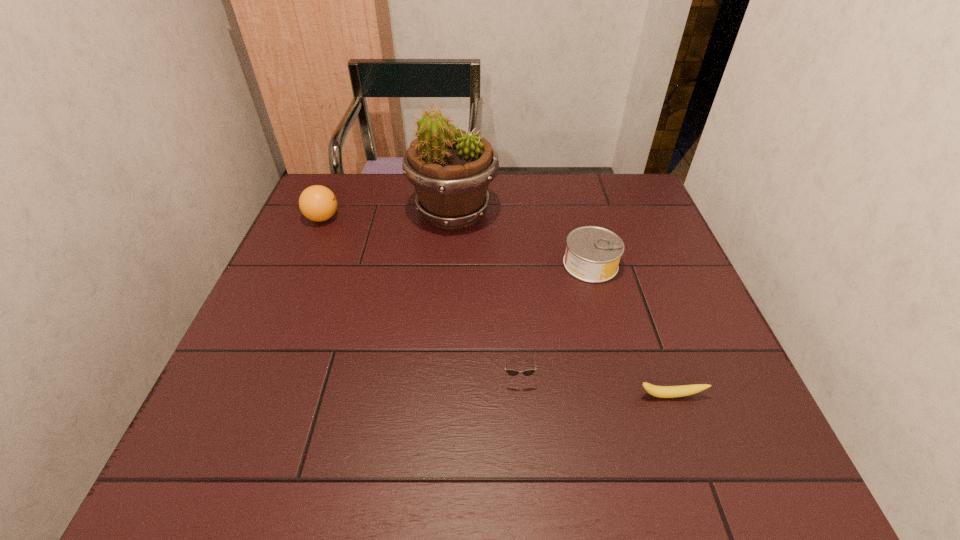
The width and height of the screenshot is (960, 540). Find the location of `vacant area located 0.150m in front of the lenses of the sunglasses`. vacant area located 0.150m in front of the lenses of the sunglasses is located at coordinates tap(525, 463).

Where is `free space located 0.140m on the upward curve of the banana`? This screenshot has height=540, width=960. free space located 0.140m on the upward curve of the banana is located at coordinates (697, 472).

What are the coordinates of `flowerpot located in the far edge section of the desktop` in the screenshot? It's located at (451, 169).

Where is `ping-pong ball that is at the far edge`? This screenshot has width=960, height=540. ping-pong ball that is at the far edge is located at coordinates (318, 203).

Find the location of a particular element. The height and width of the screenshot is (540, 960). object positioned at the left edge is located at coordinates (318, 203).

Identify the location of can that is at the right edge. The width and height of the screenshot is (960, 540). pos(593,253).

At what (x,y) coordinates should I click in order to perform the action: click on banana that is at the right edge. Please return your answer as a coordinate pair (x, y). Looking at the image, I should click on (685, 390).

The height and width of the screenshot is (540, 960). Find the location of `object located at the far left corner`. object located at the far left corner is located at coordinates (318, 203).

Identify the location of free space at the far edge of the desktop. (519, 183).

In the image, there is a desktop. At what (x,y) coordinates should I click in order to perform the action: click on free region at the near edge. Please return your answer as a coordinate pair (x, y). Looking at the image, I should click on (284, 441).